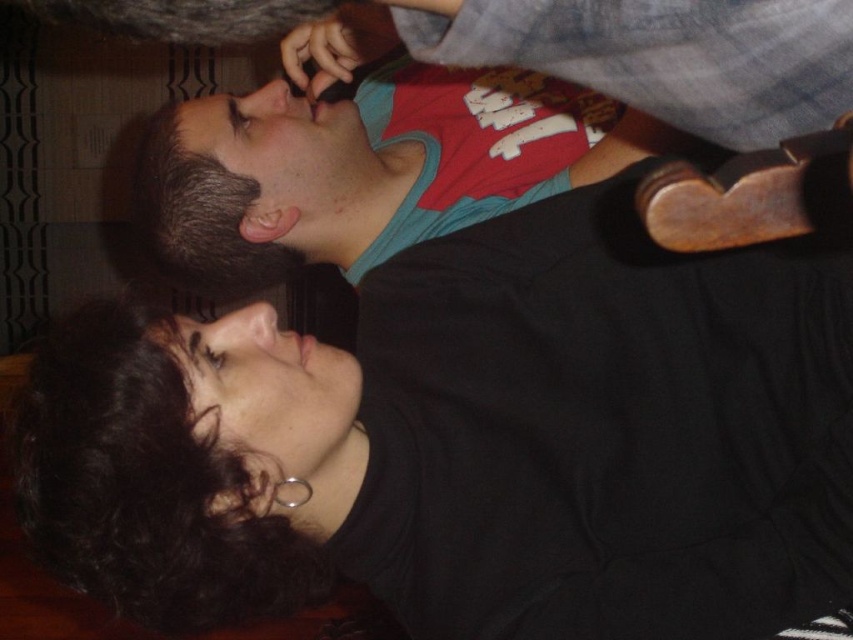
Is black matte shirt at upper center to the left of dark curly hair at lower left from the viewer's perspective?

In fact, black matte shirt at upper center is to the right of dark curly hair at lower left.

Looking at this image, between black matte shirt at upper center and dark curly hair at lower left, which one appears on the right side from the viewer's perspective?

Positioned to the right is black matte shirt at upper center.

Between point (200, 472) and point (128, 413), which one is positioned in front?

Positioned in front is point (128, 413).

The height and width of the screenshot is (640, 853). I want to click on black matte shirt at upper center, so click(x=473, y=440).

Which is behind, point (47, 385) or point (259, 205)?

The point (259, 205) is more distant.

Who is higher up, dark curly hair at lower left or matte green head at upper center?

matte green head at upper center is above.

You are a GUI agent. You are given a task and a screenshot of the screen. Output one action in this format:
    pyautogui.click(x=<x>, y=<y>)
    Task: Click on the dark curly hair at lower left
    
    Given the screenshot: What is the action you would take?
    pyautogui.click(x=142, y=481)

Where is `dark curly hair at lower left`? This screenshot has height=640, width=853. dark curly hair at lower left is located at coordinates (142, 481).

In order to click on black matte shirt at upper center in this screenshot , I will do [473, 440].

This screenshot has height=640, width=853. Describe the element at coordinates (473, 440) in the screenshot. I see `black matte shirt at upper center` at that location.

The width and height of the screenshot is (853, 640). I want to click on black matte shirt at upper center, so click(473, 440).